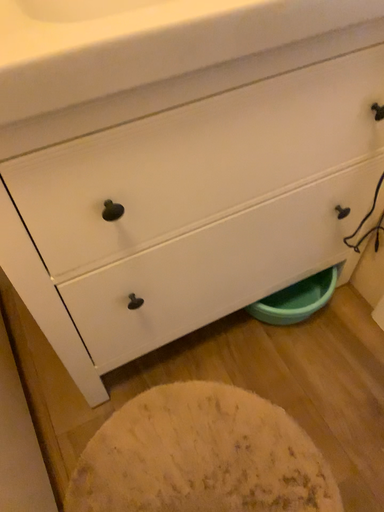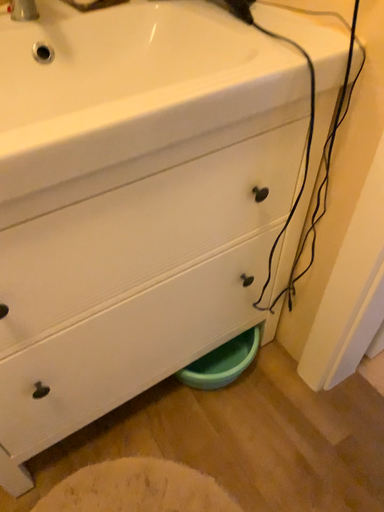
Question: How did the camera likely rotate when shooting the video?

Choices:
 (A) rotated upward
 (B) rotated downward

Answer: (A)